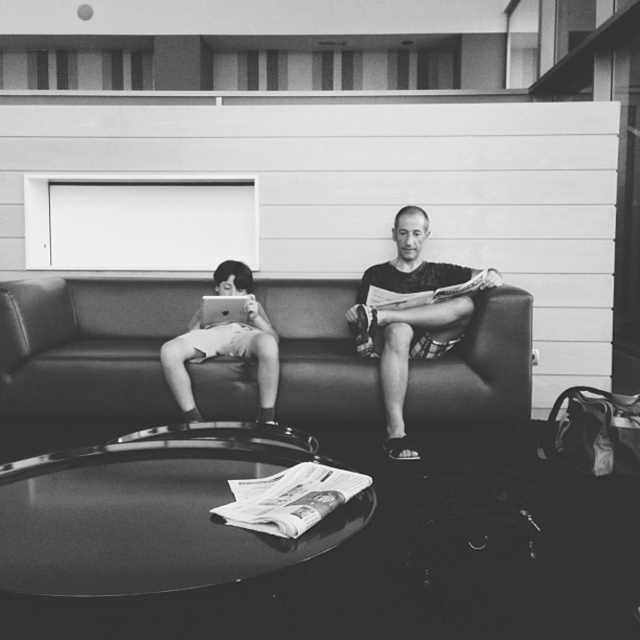
Question: Which is farther from the smooth beige shorts at left?

Choices:
 (A) matte black laptop at left
 (B) leather couch at center
 (C) smooth black shorts at center

Answer: (C)

Question: Which of these objects is positioned farthest from the smooth black shorts at center?

Choices:
 (A) matte black laptop at left
 (B) smooth beige shorts at left

Answer: (A)

Question: Is smooth black shorts at center wider than smooth beige shorts at left?

Choices:
 (A) no
 (B) yes

Answer: (B)

Question: Does smooth black shorts at center appear under smooth beige shorts at left?

Choices:
 (A) no
 (B) yes

Answer: (A)

Question: Which of the following is the closest to the observer?

Choices:
 (A) smooth beige shorts at left
 (B) matte black laptop at left
 (C) smooth black shorts at center
 (D) leather couch at center

Answer: (C)

Question: From the image, what is the correct spatial relationship of smooth black shorts at center in relation to matte black laptop at left?

Choices:
 (A) right
 (B) left

Answer: (A)